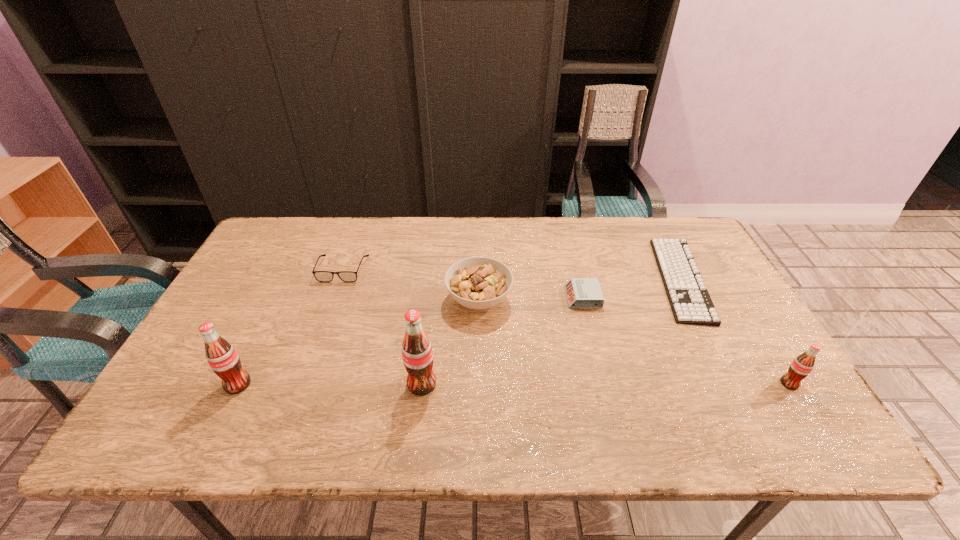
Please point a location where one more pop_(soda) can be added evenly. Please provide its 2D coordinates. Your answer should be formatted as a tuple, i.e. [(x, y)], where the tuple contains the x and y coordinates of a point satisfying the conditions above.

[(606, 383)]